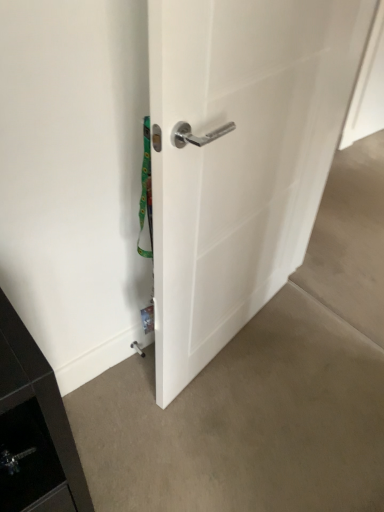
Identify the location of light brown carpet at lower center, which is the first concrete in bottom-to-top order. Image resolution: width=384 pixels, height=512 pixels. (243, 422).

Locate an element on the screen. white glossy door handle at center is located at coordinates (238, 158).

From a real-world perspective, is white glossy door handle at center positioned above or below smooth concrete floor at lower right, the 2th concrete ordered from the bottom?

Clearly, from a real-world perspective, white glossy door handle at center is above smooth concrete floor at lower right, the 2th concrete ordered from the bottom.

Based on the photo, can you confirm if white glossy door handle at center is wider than smooth concrete floor at lower right, the 2th concrete ordered from the bottom?

No, white glossy door handle at center is not wider than smooth concrete floor at lower right, the 2th concrete ordered from the bottom.

Is white glossy door handle at center positioned with its back to smooth concrete floor at lower right, the 1th concrete in the top-to-bottom sequence?

No, white glossy door handle at center is not facing the opposite direction of smooth concrete floor at lower right, the 1th concrete in the top-to-bottom sequence.

Is white glossy door handle at center in contact with smooth concrete floor at lower right, the 2th concrete ordered from the bottom?

white glossy door handle at center is not next to smooth concrete floor at lower right, the 2th concrete ordered from the bottom, and they're not touching.

From the image's perspective, between smooth concrete floor at lower right, the 1th concrete in the top-to-bottom sequence, and light brown carpet at lower center, which is the first concrete in bottom-to-top order, which one is located above?

From the image's view, smooth concrete floor at lower right, the 1th concrete in the top-to-bottom sequence, is above.

In the scene shown: Which object is further away from the camera taking this photo, smooth concrete floor at lower right, the 2th concrete ordered from the bottom, or light brown carpet at lower center, which is the first concrete in bottom-to-top order?

smooth concrete floor at lower right, the 2th concrete ordered from the bottom, is more distant.

From a real-world perspective, does smooth concrete floor at lower right, the 2th concrete ordered from the bottom, sit lower than light brown carpet at lower center, which appears as the 2th concrete when viewed from the top?

No, from a real-world perspective, smooth concrete floor at lower right, the 2th concrete ordered from the bottom, is not under light brown carpet at lower center, which appears as the 2th concrete when viewed from the top.

From a real-world perspective, is light brown carpet at lower center, which is the first concrete in bottom-to-top order, located beneath white glossy door handle at center?

Yes, from a real-world perspective, light brown carpet at lower center, which is the first concrete in bottom-to-top order, is beneath white glossy door handle at center.

Considering the points (320, 493) and (310, 86), which point is behind, point (320, 493) or point (310, 86)?

The point (320, 493) is farther.

This screenshot has height=512, width=384. I want to click on door above the light brown carpet at lower center, which appears as the 2th concrete when viewed from the top (from a real-world perspective), so click(238, 158).

Is light brown carpet at lower center, which appears as the 2th concrete when viewed from the top, taller or shorter than white glossy door handle at center?

Considering their sizes, light brown carpet at lower center, which appears as the 2th concrete when viewed from the top, has less height than white glossy door handle at center.

You are a GUI agent. You are given a task and a screenshot of the screen. Output one action in this format:
    pyautogui.click(x=<x>, y=<y>)
    Task: Click on the door that appears above the light brown carpet at lower center, which appears as the 2th concrete when viewed from the top (from the image's perspective)
    The width and height of the screenshot is (384, 512).
    Given the screenshot: What is the action you would take?
    pyautogui.click(x=238, y=158)

From a real-world perspective, who is located lower, white glossy door handle at center or light brown carpet at lower center, which is the first concrete in bottom-to-top order?

From a 3D spatial view, light brown carpet at lower center, which is the first concrete in bottom-to-top order, is below.

Does point (183, 150) appear closer or farther from the camera than point (225, 424)?

Point (183, 150).

Could you tell me if white glossy door handle at center is facing light brown carpet at lower center, which is the first concrete in bottom-to-top order?

Yes, white glossy door handle at center faces towards light brown carpet at lower center, which is the first concrete in bottom-to-top order.

In the scene shown: Who is bigger, light brown carpet at lower center, which is the first concrete in bottom-to-top order, or smooth concrete floor at lower right, the 1th concrete in the top-to-bottom sequence?

smooth concrete floor at lower right, the 1th concrete in the top-to-bottom sequence.

Is light brown carpet at lower center, which is the first concrete in bottom-to-top order, next to smooth concrete floor at lower right, the 2th concrete ordered from the bottom?

No, light brown carpet at lower center, which is the first concrete in bottom-to-top order, is not in contact with smooth concrete floor at lower right, the 2th concrete ordered from the bottom.

The height and width of the screenshot is (512, 384). I want to click on concrete located in front of the smooth concrete floor at lower right, the 1th concrete in the top-to-bottom sequence, so click(x=243, y=422).

How distant is light brown carpet at lower center, which is the first concrete in bottom-to-top order, from smooth concrete floor at lower right, the 1th concrete in the top-to-bottom sequence?

light brown carpet at lower center, which is the first concrete in bottom-to-top order, and smooth concrete floor at lower right, the 1th concrete in the top-to-bottom sequence, are 27.02 inches apart from each other.

Is smooth concrete floor at lower right, the 1th concrete in the top-to-bottom sequence, looking in the opposite direction of white glossy door handle at center?

No.

From the white glossy door handle at center, count 2nd concretes backward and point to it. Please provide its 2D coordinates.

[(350, 240)]

From a real-world perspective, which is physically below, smooth concrete floor at lower right, the 2th concrete ordered from the bottom, or white glossy door handle at center?

smooth concrete floor at lower right, the 2th concrete ordered from the bottom, is physically lower.

Is point (379, 259) positioned in front of point (314, 38)?

No, (379, 259) is further to viewer.

The height and width of the screenshot is (512, 384). I want to click on door below the smooth concrete floor at lower right, the 1th concrete in the top-to-bottom sequence (from the image's perspective), so click(238, 158).

Where is `concrete above the light brown carpet at lower center, which is the first concrete in bottom-to-top order (from a real-world perspective)`? The height and width of the screenshot is (512, 384). concrete above the light brown carpet at lower center, which is the first concrete in bottom-to-top order (from a real-world perspective) is located at coordinates (350, 240).

Estimate the real-world distances between objects in this image. Which object is closer to white glossy door handle at center, smooth concrete floor at lower right, the 1th concrete in the top-to-bottom sequence, or light brown carpet at lower center, which appears as the 2th concrete when viewed from the top?

Among the two, light brown carpet at lower center, which appears as the 2th concrete when viewed from the top, is located nearer to white glossy door handle at center.

Considering their positions, is light brown carpet at lower center, which appears as the 2th concrete when viewed from the top, positioned closer to white glossy door handle at center than smooth concrete floor at lower right, the 1th concrete in the top-to-bottom sequence?

light brown carpet at lower center, which appears as the 2th concrete when viewed from the top, lies closer to white glossy door handle at center than the other object.

Considering their positions, is light brown carpet at lower center, which is the first concrete in bottom-to-top order, positioned closer to smooth concrete floor at lower right, the 1th concrete in the top-to-bottom sequence, than white glossy door handle at center?

The object closer to smooth concrete floor at lower right, the 1th concrete in the top-to-bottom sequence, is light brown carpet at lower center, which is the first concrete in bottom-to-top order.

Based on their spatial positions, is white glossy door handle at center or light brown carpet at lower center, which appears as the 2th concrete when viewed from the top, further from smooth concrete floor at lower right, the 1th concrete in the top-to-bottom sequence?

white glossy door handle at center lies further to smooth concrete floor at lower right, the 1th concrete in the top-to-bottom sequence, than the other object.

Considering their positions, is white glossy door handle at center positioned further to light brown carpet at lower center, which appears as the 2th concrete when viewed from the top, than smooth concrete floor at lower right, the 2th concrete ordered from the bottom?

smooth concrete floor at lower right, the 2th concrete ordered from the bottom.

Looking at the image, which one is located closer to light brown carpet at lower center, which appears as the 2th concrete when viewed from the top, smooth concrete floor at lower right, the 1th concrete in the top-to-bottom sequence, or white glossy door handle at center?

white glossy door handle at center.

Identify the location of door between smooth concrete floor at lower right, the 2th concrete ordered from the bottom, and light brown carpet at lower center, which is the first concrete in bottom-to-top order, vertically. This screenshot has width=384, height=512. (238, 158).